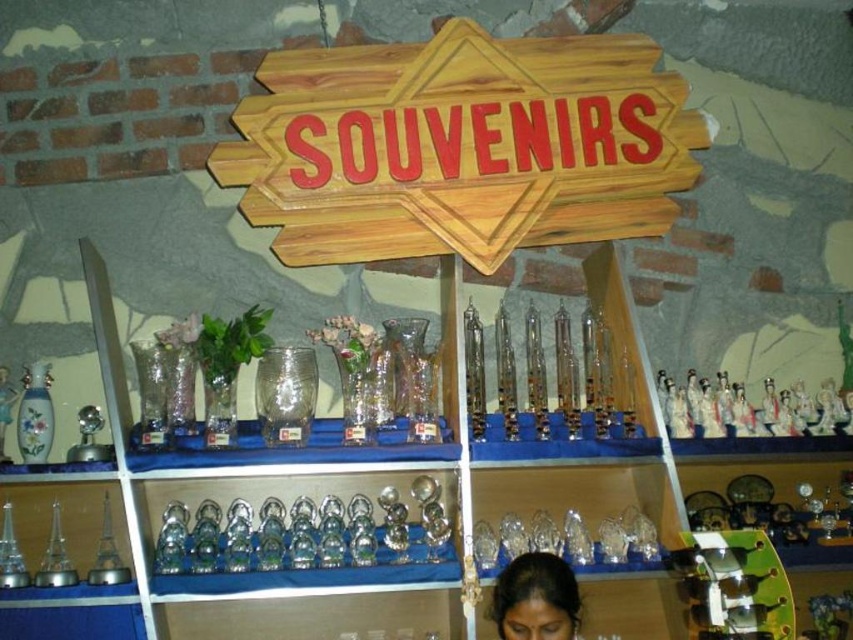
You are standing in front of the souvenir shop display and want to place a new souvenir between the two points marked as point (300, 120) and point (497, 632). Since you can only place it in front of one of them, which point should you choose to ensure the new souvenir is closer to the viewer?

You should place the new souvenir in front of point (497, 632) because point (300, 120) is behind point (497, 632), making the latter closer to the viewer.

You are standing in front of the souvenir shop display and want to locate the point at coordinates (461, 147). According to the image, where exactly is this point located?

The point at coordinates (461, 147) is located on the wooden sign at upper center.